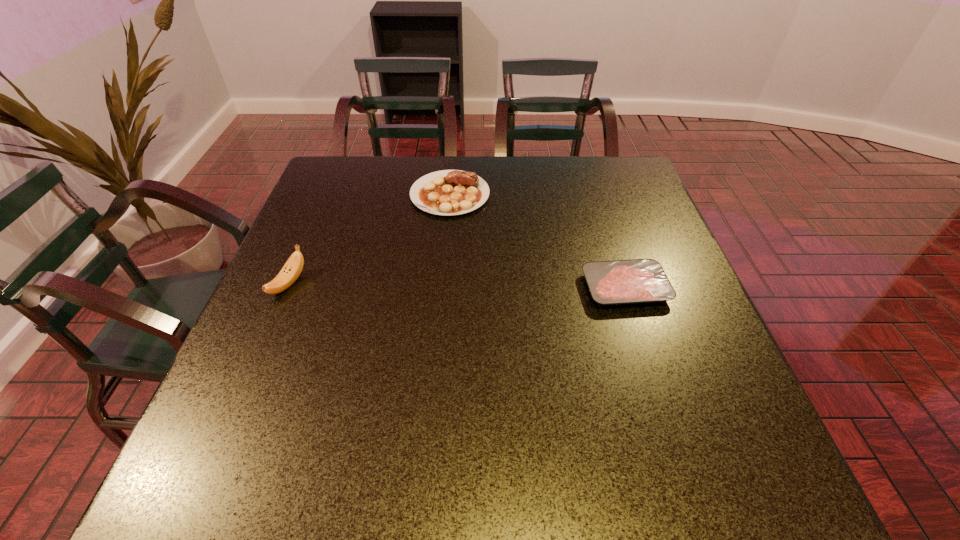
I want to click on object that is at the left edge, so click(x=290, y=272).

At what (x,y) coordinates should I click in order to perform the action: click on object located in the right edge section of the desktop. Please return your answer as a coordinate pair (x, y). Looking at the image, I should click on pos(615,282).

This screenshot has width=960, height=540. I want to click on free spot at the far edge of the desktop, so (534, 192).

The image size is (960, 540). In the image, there is a desktop. What are the coordinates of `blank space at the near edge` in the screenshot? It's located at (335, 492).

In order to click on vacant area at the left edge in this screenshot , I will do `click(304, 244)`.

In the image, there is a desktop. Identify the location of free space at the right edge. This screenshot has height=540, width=960. (636, 204).

The height and width of the screenshot is (540, 960). In the image, there is a desktop. Identify the location of blank space at the far left corner. (349, 177).

Locate an element on the screen. This screenshot has height=540, width=960. free region at the far right corner of the desktop is located at coordinates (603, 194).

At what (x,y) coordinates should I click in order to perform the action: click on free spot at the near right corner of the desktop. Please return your answer as a coordinate pair (x, y). Looking at the image, I should click on (741, 449).

You are a GUI agent. You are given a task and a screenshot of the screen. Output one action in this format:
    pyautogui.click(x=<x>, y=<y>)
    Task: Click on the empty space between the second object from right to left and the banana
    
    Given the screenshot: What is the action you would take?
    tap(370, 239)